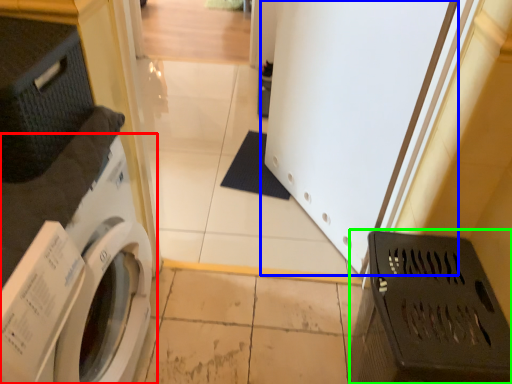
Question: Which is farther away from washing machine (highlighted by a red box)? screen door (highlighted by a blue box) or laundry basket (highlighted by a green box)?

Choices:
 (A) screen door
 (B) laundry basket

Answer: (A)